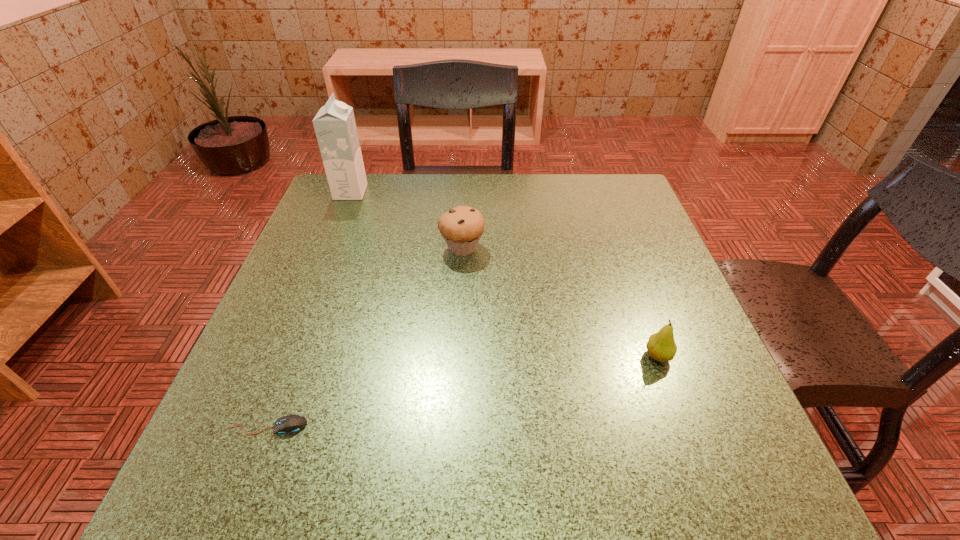
The image size is (960, 540). In order to click on the tallest object in this screenshot , I will do pyautogui.click(x=335, y=127).

Where is `carton`? Image resolution: width=960 pixels, height=540 pixels. carton is located at coordinates (335, 127).

Locate an element on the screen. The width and height of the screenshot is (960, 540). the third nearest object is located at coordinates (461, 227).

The width and height of the screenshot is (960, 540). I want to click on the second object from right to left, so click(x=461, y=227).

This screenshot has height=540, width=960. Find the location of `the third farthest object`. the third farthest object is located at coordinates (661, 346).

Find the location of a particular element. Image resolution: width=960 pixels, height=540 pixels. the rightmost object is located at coordinates click(661, 346).

Locate an element on the screen. This screenshot has height=540, width=960. the nearest object is located at coordinates (291, 424).

The width and height of the screenshot is (960, 540). I want to click on the shortest object, so pyautogui.click(x=291, y=424).

I want to click on free region located 0.130m on the front label of the tallest object, so click(x=414, y=192).

Locate an element on the screen. This screenshot has height=540, width=960. vacant position located on the right of the third object from left to right is located at coordinates (564, 248).